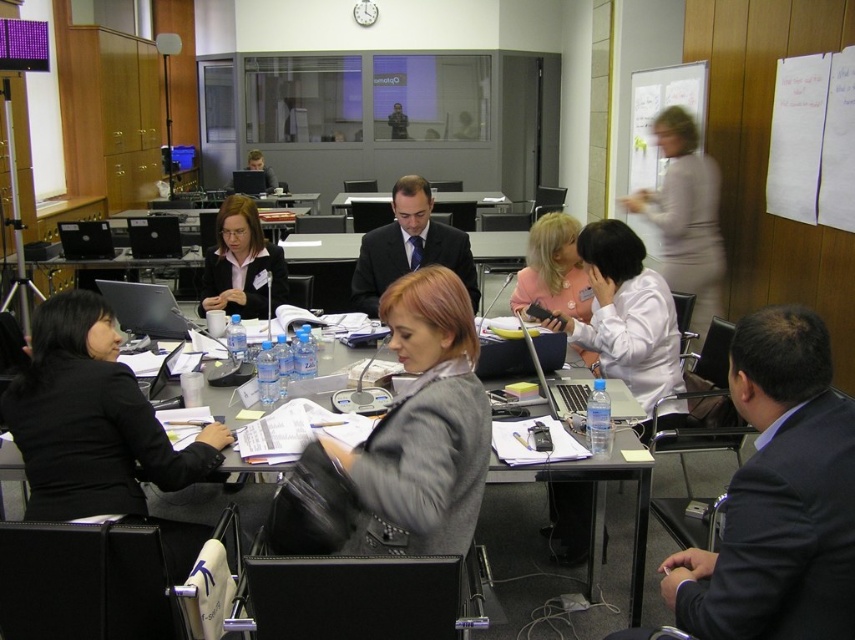
Question: Based on their relative distances, which object is nearer to the dark suit at center?

Choices:
 (A) black matte jacket at left
 (B) white glossy shirt at center
 (C) light gray sweater at center

Answer: (B)

Question: Does matte gray desk at center have a greater width compared to dark suit at center?

Choices:
 (A) no
 (B) yes

Answer: (A)

Question: Is white glossy shirt at center behind matte gray desk at center?

Choices:
 (A) no
 (B) yes

Answer: (B)

Question: Which object is positioned closest to the dark suit at center?

Choices:
 (A) matte black jacket at center
 (B) matte pink blouse at center

Answer: (B)

Question: Does matte black jacket at center appear under matte pink blouse at center?

Choices:
 (A) no
 (B) yes

Answer: (A)

Question: Which object is farther from the camera taking this photo?

Choices:
 (A) black matte jacket at left
 (B) dark suit at center

Answer: (B)